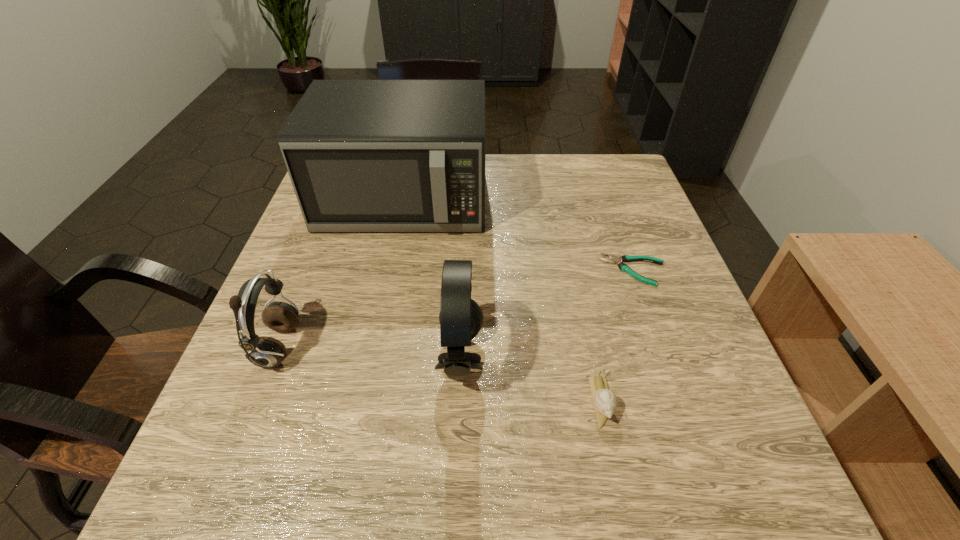
Where is `vacant area that lies between the second object from right to left and the microwave oven`? The height and width of the screenshot is (540, 960). vacant area that lies between the second object from right to left and the microwave oven is located at coordinates (502, 299).

I want to click on free point between the shortest object and the escargot, so click(x=616, y=335).

Identify the location of free space between the fourth tallest object and the fourth shortest object. (531, 379).

Locate an element on the screen. The height and width of the screenshot is (540, 960). free area in between the shortest object and the second shortest object is located at coordinates (616, 335).

Where is `free spot between the escargot and the farthest object`? Image resolution: width=960 pixels, height=540 pixels. free spot between the escargot and the farthest object is located at coordinates (502, 299).

I want to click on object that is the closest to the left earphone, so click(x=363, y=155).

Identify which object is located as the third nearest to the farthest object. Please provide its 2D coordinates. Your answer should be formatted as a tuple, i.e. [(x, y)], where the tuple contains the x and y coordinates of a point satisfying the conditions above.

[(626, 258)]

At what (x,y) coordinates should I click in order to perform the action: click on vacant region that satisfies the following two spatial constraints: 1. on the front-facing side of the farthest object; 2. on the right side of the fourth nearest object. Please return your answer as a coordinate pair (x, y). The width and height of the screenshot is (960, 540). Looking at the image, I should click on (388, 269).

I want to click on vacant space that satisfies the following two spatial constraints: 1. on the front-facing side of the microwave oven; 2. on the ear pads of the third tallest object, so click(x=372, y=347).

This screenshot has height=540, width=960. Identify the location of vacant region that satisfies the following two spatial constraints: 1. on the front-facing side of the microwave oven; 2. on the right side of the pliers. (388, 269).